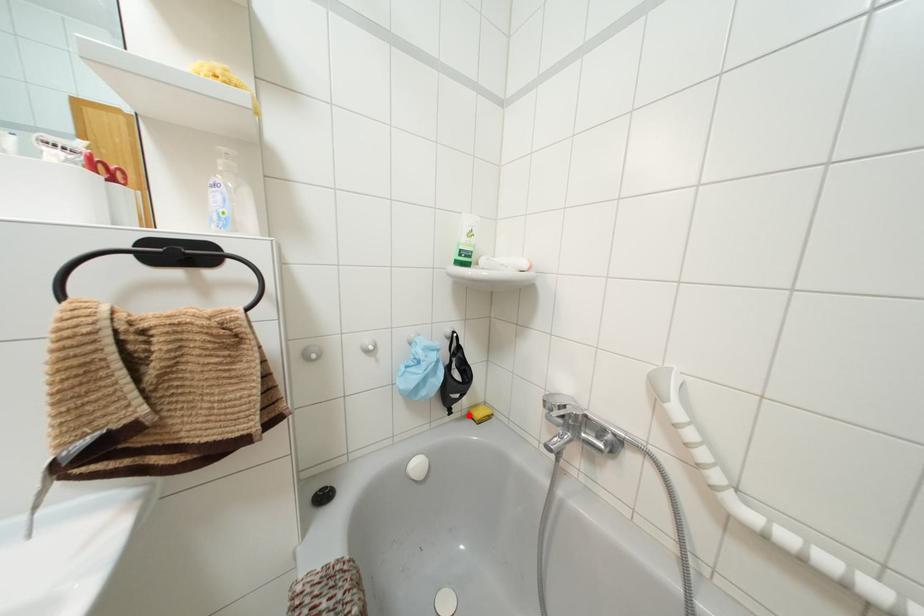
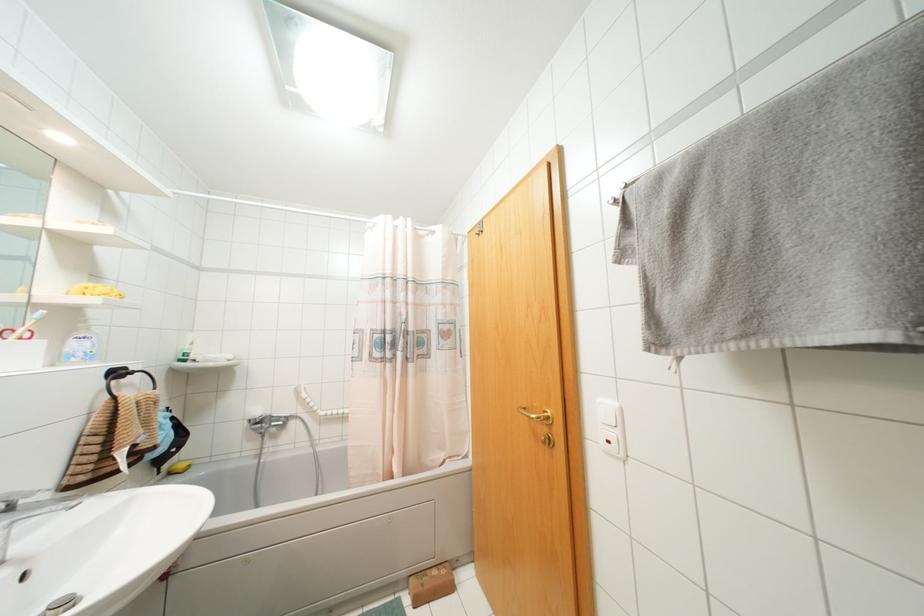
Locate, in the second image, the point that corresponds to the highlighted location in the first image.

(169, 472)